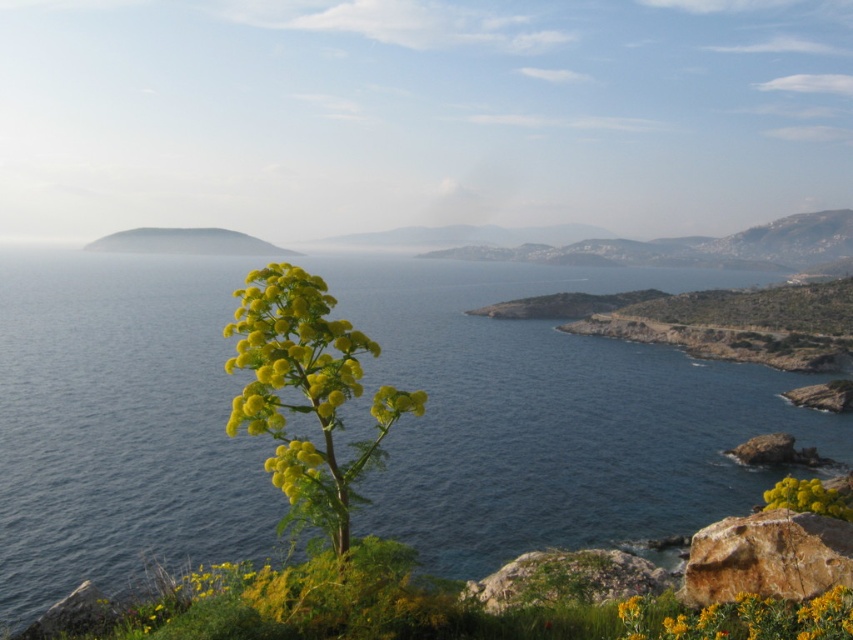
Question: Which object is the farthest from the blue water at center?

Choices:
 (A) yellow fluffy plant at center
 (B) yellow matte flower at lower right

Answer: (A)

Question: Does blue water at center have a lesser width compared to brown rough rock at lower right?

Choices:
 (A) no
 (B) yes

Answer: (A)

Question: Which point is closer to the camera?

Choices:
 (A) yellow fluffy plant at center
 (B) green matte hillside at upper center

Answer: (A)

Question: Which object is the closest to the blue water at center?

Choices:
 (A) brown rough rock at lower right
 (B) green matte hillside at upper center
 (C) yellow fluffy plant at center

Answer: (C)

Question: Does blue water at center appear on the right side of yellow matte flower at lower right?

Choices:
 (A) yes
 (B) no

Answer: (B)

Question: Can you confirm if yellow fluffy plant at center is positioned above green matte hillside at upper center?

Choices:
 (A) yes
 (B) no

Answer: (B)